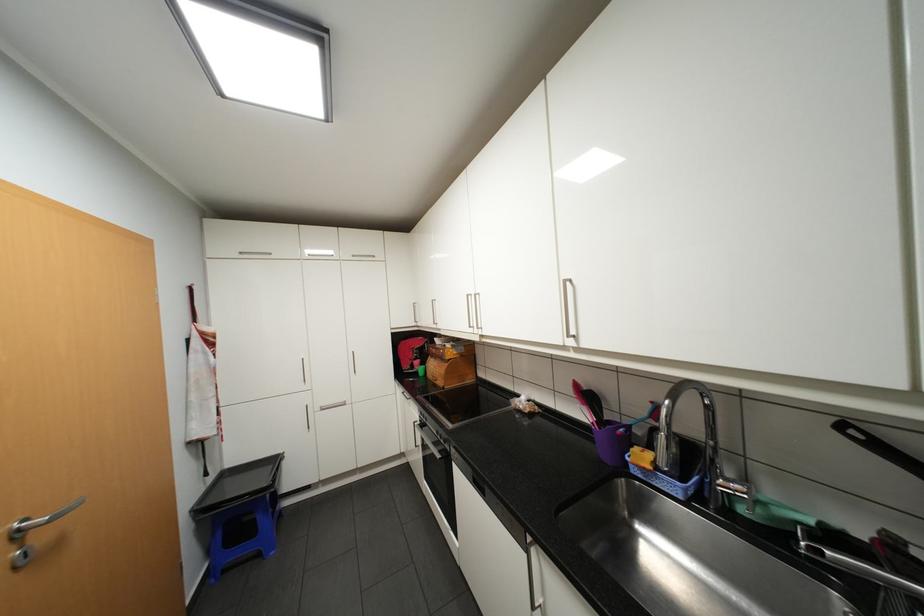
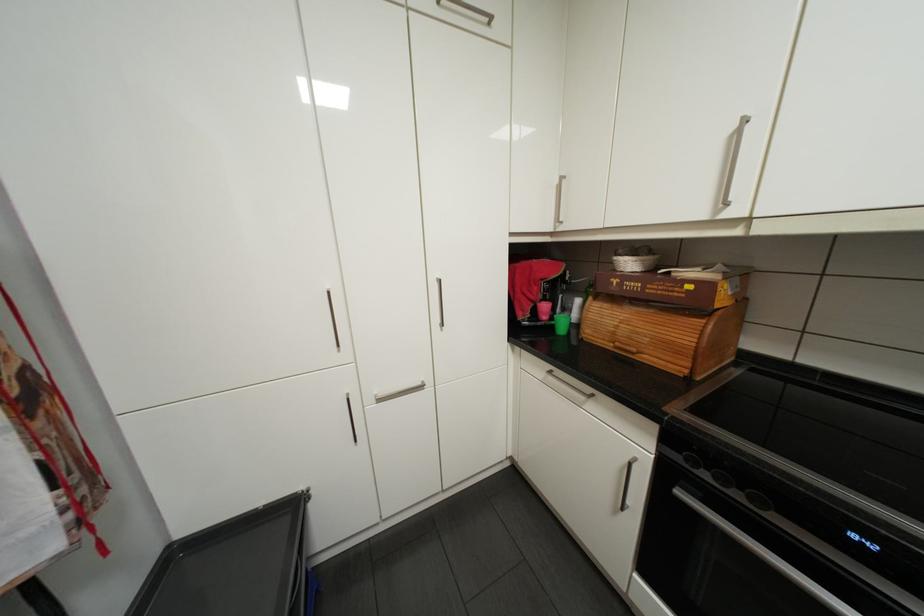
Find the pixel in the second image that matches point 283,460 in the first image.

(300, 507)